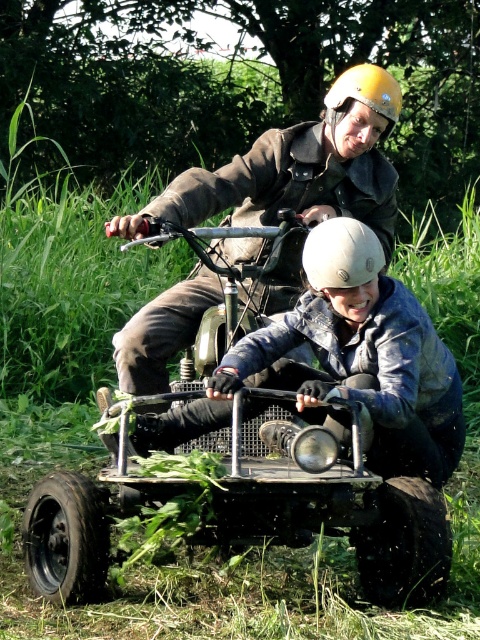
You are a photographer trying to capture a clear photo of both the white matte helmet at center and the yellow matte helmet at upper center. Based on their positions, which helmet should you focus on first to ensure both are in frame?

The white matte helmet at center is to the left of the yellow matte helmet at upper center, so you should focus on the yellow matte helmet at upper center first to ensure both are in frame as you adjust the camera angle.

You are a safety inspector checking the helmets of the riders. According to the image, which helmet is positioned higher from the ground between the white matte helmet at center and the yellow matte helmet at upper center?

The white matte helmet at center is taller than the yellow matte helmet at upper center, so the white matte helmet at center is positioned higher from the ground.